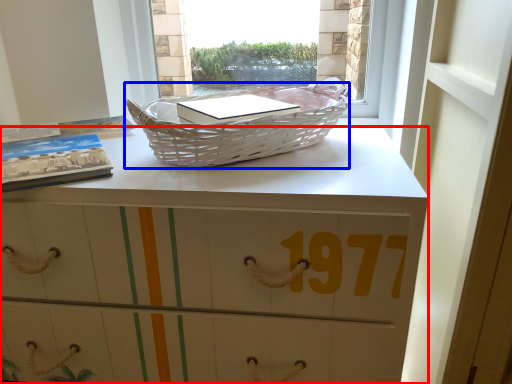
Question: Which object appears closest to the camera in this image, desk (highlighted by a red box) or picnic basket (highlighted by a blue box)?

Choices:
 (A) desk
 (B) picnic basket

Answer: (A)